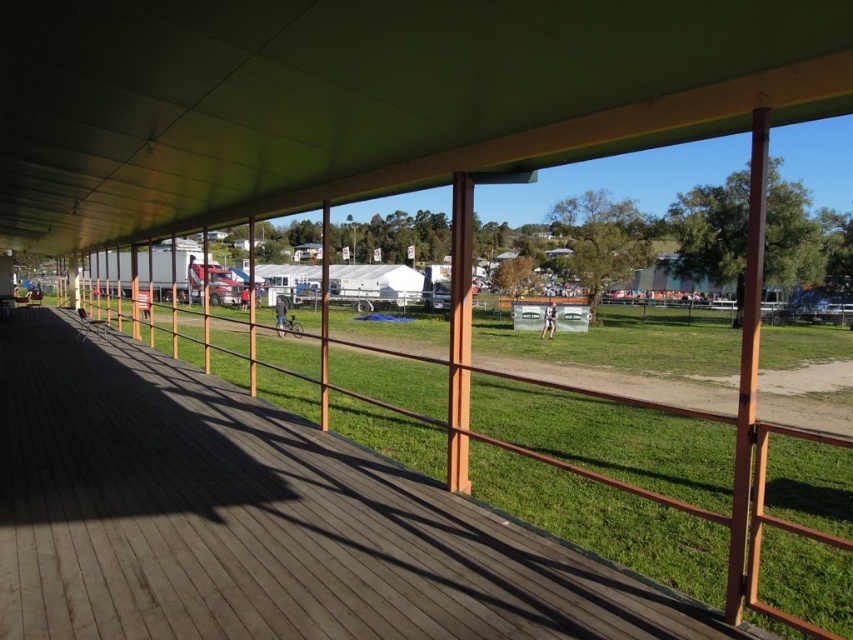
Does green matte canopy at upper center appear on the right side of brown wooden deck at center?

No, green matte canopy at upper center is not to the right of brown wooden deck at center.

In the scene shown: How much distance is there between green matte canopy at upper center and brown wooden deck at center?

A distance of 2.20 meters exists between green matte canopy at upper center and brown wooden deck at center.

The height and width of the screenshot is (640, 853). In order to click on green matte canopy at upper center in this screenshot , I will do `click(368, 97)`.

The image size is (853, 640). I want to click on green matte canopy at upper center, so click(368, 97).